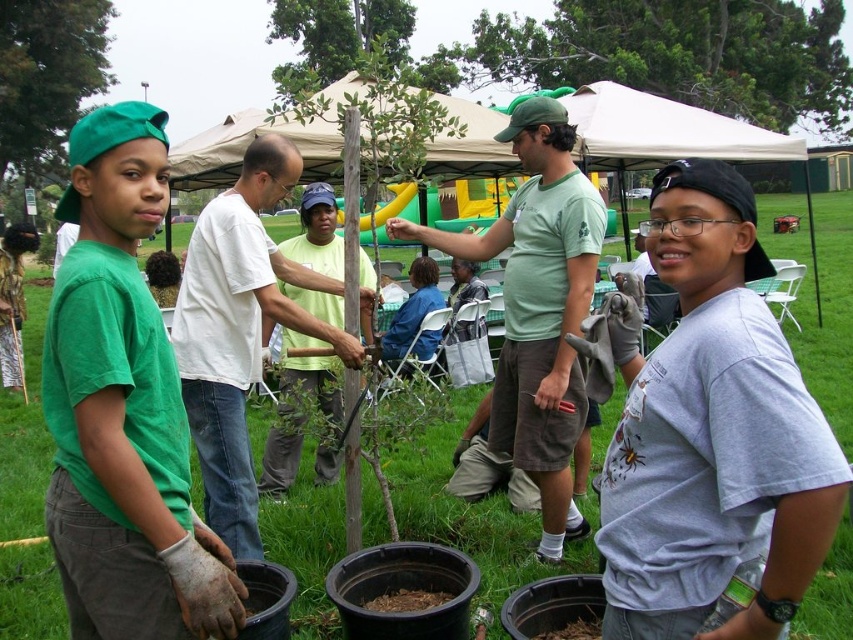
Does white cotton shirt at center have a greater height compared to green leafy tree at upper center?

Incorrect, white cotton shirt at center's height is not larger of green leafy tree at upper center's.

Is white cotton shirt at center below green leafy tree at upper center?

Indeed, white cotton shirt at center is positioned under green leafy tree at upper center.

Which is in front, point (206, 442) or point (306, 54)?

Point (206, 442) is more forward.

Where is `white cotton shirt at center`? This screenshot has height=640, width=853. white cotton shirt at center is located at coordinates (239, 330).

Can you confirm if green matte shirt at center is positioned to the right of light green t-shirt at center?

No, green matte shirt at center is not to the right of light green t-shirt at center.

Which is more to the left, green matte shirt at center or light green t-shirt at center?

From the viewer's perspective, green matte shirt at center appears more on the left side.

Locate an element on the screen. The width and height of the screenshot is (853, 640). green matte shirt at center is located at coordinates (123, 408).

Is green cotton shirt at center shorter than light green t-shirt at center?

No, green cotton shirt at center is not shorter than light green t-shirt at center.

Can you confirm if green cotton shirt at center is positioned below light green t-shirt at center?

Indeed, green cotton shirt at center is positioned under light green t-shirt at center.

Does point (550, 474) come behind point (323, 481)?

No, it is in front of (323, 481).

Identify the location of green cotton shirt at center. (538, 307).